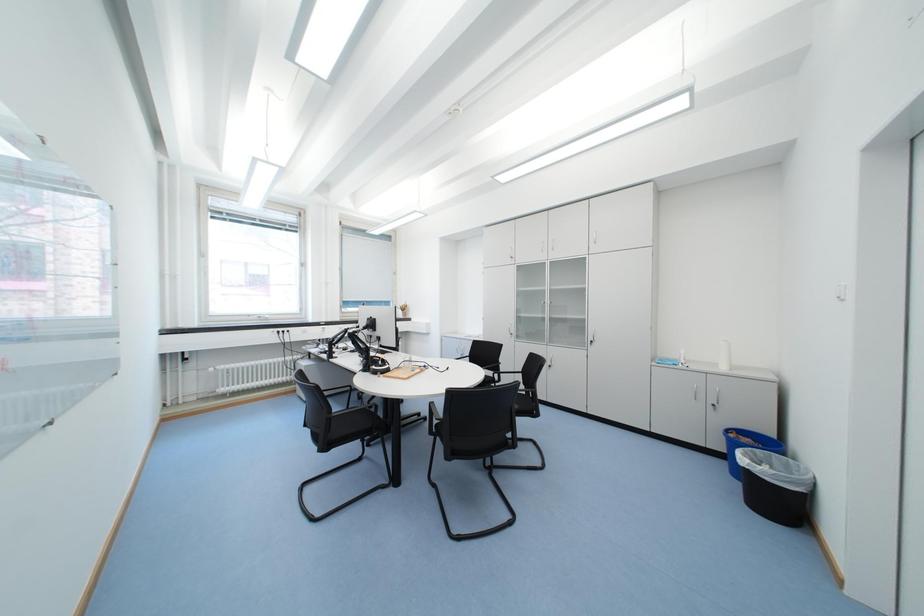
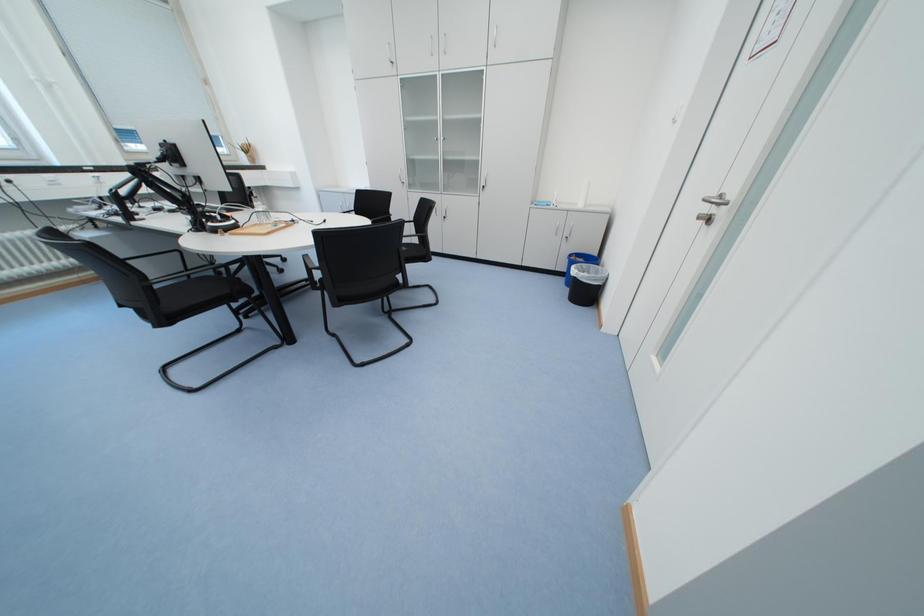
First-person continuous shooting, in which direction is the camera rotating?

The rotation direction of the camera is right-down.